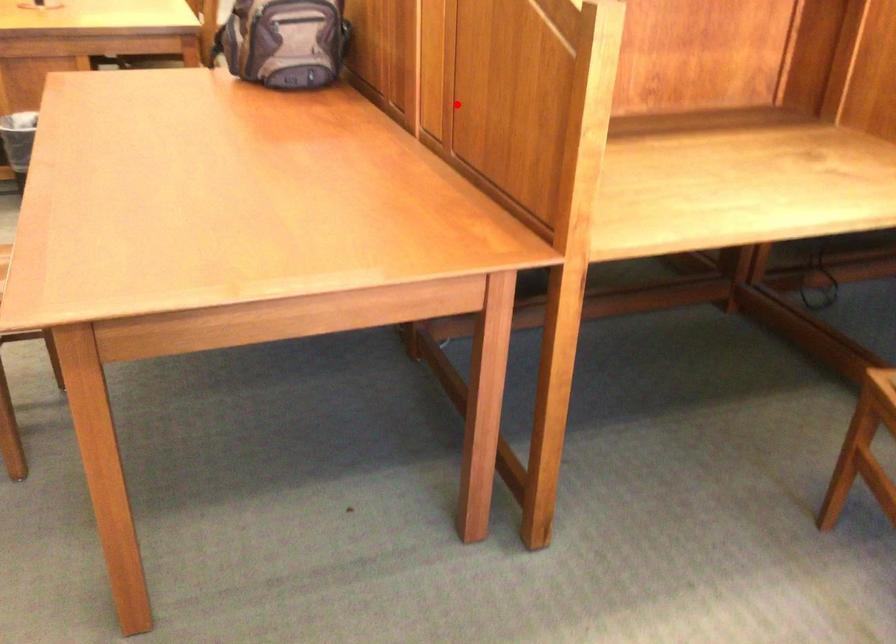
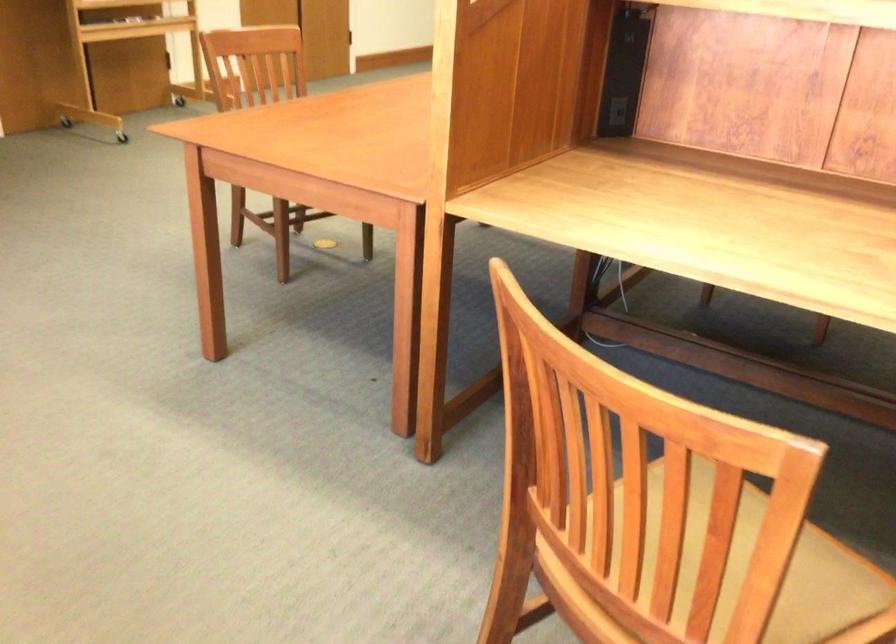
Locate, in the second image, the point that corresponds to the highlighted location in the first image.

(616, 111)